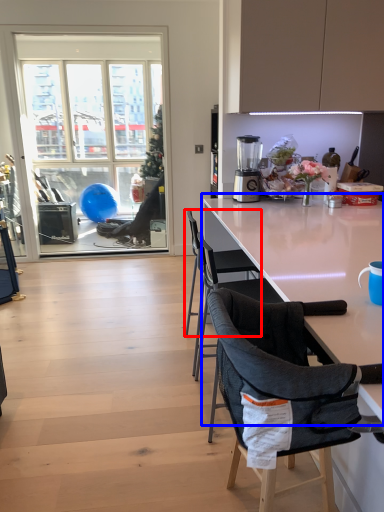
Question: Which of the following is the farthest to the observer, chair (highlighted by a red box) or kitchen & dining room table (highlighted by a blue box)?

Choices:
 (A) chair
 (B) kitchen & dining room table

Answer: (A)